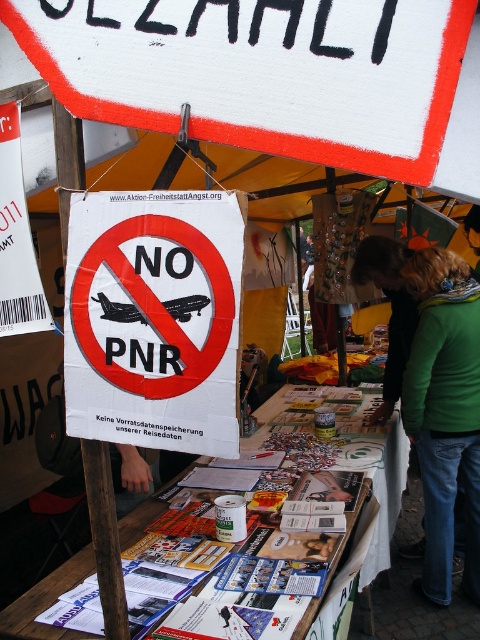
Question: Does yellow fabric canopy at upper center lie behind green fabric jacket at lower right?

Choices:
 (A) no
 (B) yes

Answer: (A)

Question: Estimate the real-world distances between objects in this image. Which object is closer to the green fabric jacket at lower right?

Choices:
 (A) yellow fabric canopy at upper center
 (B) white paper sign at center

Answer: (B)

Question: Does yellow fabric canopy at upper center lie in front of white paper sign at center?

Choices:
 (A) no
 (B) yes

Answer: (B)

Question: Based on their relative distances, which object is farther from the green fabric jacket at lower right?

Choices:
 (A) white paper sign at center
 (B) yellow fabric canopy at upper center

Answer: (B)

Question: Can you confirm if yellow fabric canopy at upper center is thinner than green fabric jacket at lower right?

Choices:
 (A) no
 (B) yes

Answer: (A)

Question: Which of the following is the farthest from the observer?

Choices:
 (A) click(x=367, y=49)
 (B) click(x=357, y=266)
 (C) click(x=227, y=362)

Answer: (B)